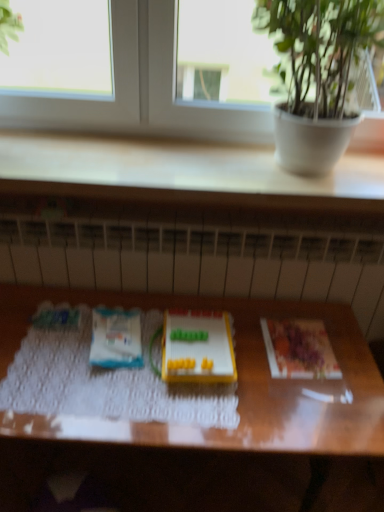
Question: Considering the relative sizes of white matte paper at center, the 1th paperback book when ordered from left to right, and transparent glass window at upper center in the image provided, is white matte paper at center, the 1th paperback book when ordered from left to right, smaller than transparent glass window at upper center?

Choices:
 (A) no
 (B) yes

Answer: (B)

Question: Is white matte paper at center, the 1th paperback book when ordered from left to right, outside transparent glass window at upper center?

Choices:
 (A) yes
 (B) no

Answer: (A)

Question: Is transparent glass window at upper center located within white matte paper at center, the 1th paperback book when ordered from left to right?

Choices:
 (A) no
 (B) yes

Answer: (A)

Question: Is white matte paper at center, the 1th paperback book when ordered from left to right, taller than transparent glass window at upper center?

Choices:
 (A) no
 (B) yes

Answer: (A)

Question: From a real-world perspective, is white matte paper at center, the 1th paperback book when ordered from left to right, positioned under transparent glass window at upper center based on gravity?

Choices:
 (A) no
 (B) yes

Answer: (B)

Question: Does white matte paper at center, the 1th paperback book when ordered from left to right, have a greater width compared to transparent glass window at upper center?

Choices:
 (A) no
 (B) yes

Answer: (B)

Question: Is white textured radiator at center oriented towards printed paper at right, the 2th paperback book viewed from the left?

Choices:
 (A) yes
 (B) no

Answer: (A)

Question: Is white textured radiator at center positioned in front of printed paper at right, which appears as the first paperback book when viewed from the right?

Choices:
 (A) no
 (B) yes

Answer: (A)

Question: Considering the relative sizes of white textured radiator at center and printed paper at right, which appears as the first paperback book when viewed from the right, in the image provided, is white textured radiator at center shorter than printed paper at right, which appears as the first paperback book when viewed from the right,?

Choices:
 (A) no
 (B) yes

Answer: (A)

Question: Is printed paper at right, which appears as the first paperback book when viewed from the right, surrounded by white textured radiator at center?

Choices:
 (A) no
 (B) yes

Answer: (A)

Question: Can you confirm if white textured radiator at center is bigger than printed paper at right, which appears as the first paperback book when viewed from the right?

Choices:
 (A) yes
 (B) no

Answer: (A)

Question: Is white textured radiator at center at the left side of printed paper at right, the 2th paperback book viewed from the left?

Choices:
 (A) yes
 (B) no

Answer: (A)

Question: Is wooden table at center located outside printed paper at right, which appears as the first paperback book when viewed from the right?

Choices:
 (A) yes
 (B) no

Answer: (A)